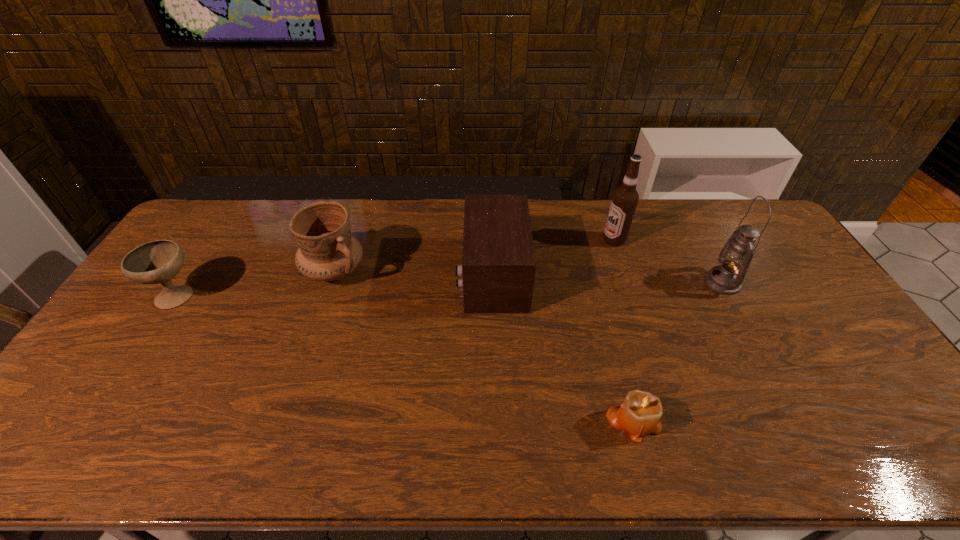
Identify the location of vacant space located 0.130m on the label of the alcohol. (565, 240).

The width and height of the screenshot is (960, 540). Identify the location of blank space located 0.140m on the front of the rightmost object. (751, 335).

The height and width of the screenshot is (540, 960). I want to click on free region located on the left of the fifth object from right to left, so click(195, 271).

In order to click on blank space located on the front-facing side of the radio receiver in this screenshot , I will do `click(362, 275)`.

Image resolution: width=960 pixels, height=540 pixels. I want to click on free space located on the front-facing side of the radio receiver, so tap(405, 275).

The width and height of the screenshot is (960, 540). What are the coordinates of `vacant space located on the front-facing side of the radio receiver` in the screenshot? It's located at (443, 275).

Identify the location of free location located on the front of the fifth tallest object. This screenshot has width=960, height=540. (78, 448).

Find the location of `free space located 0.170m on the right of the shortest object`. free space located 0.170m on the right of the shortest object is located at coordinates (731, 420).

Locate an element on the screen. The height and width of the screenshot is (540, 960). object situated at the far edge is located at coordinates (625, 198).

The image size is (960, 540). I want to click on object that is at the near edge, so click(x=640, y=414).